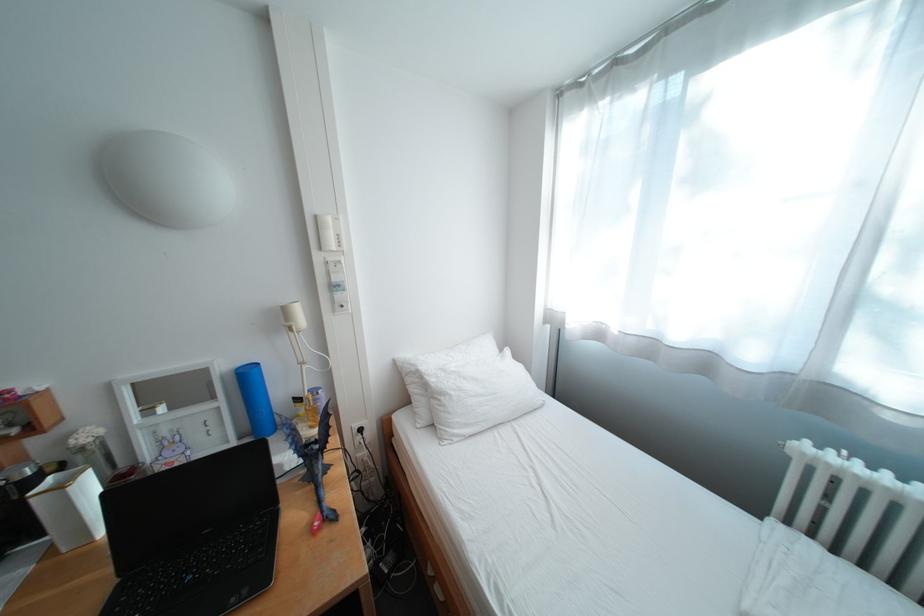
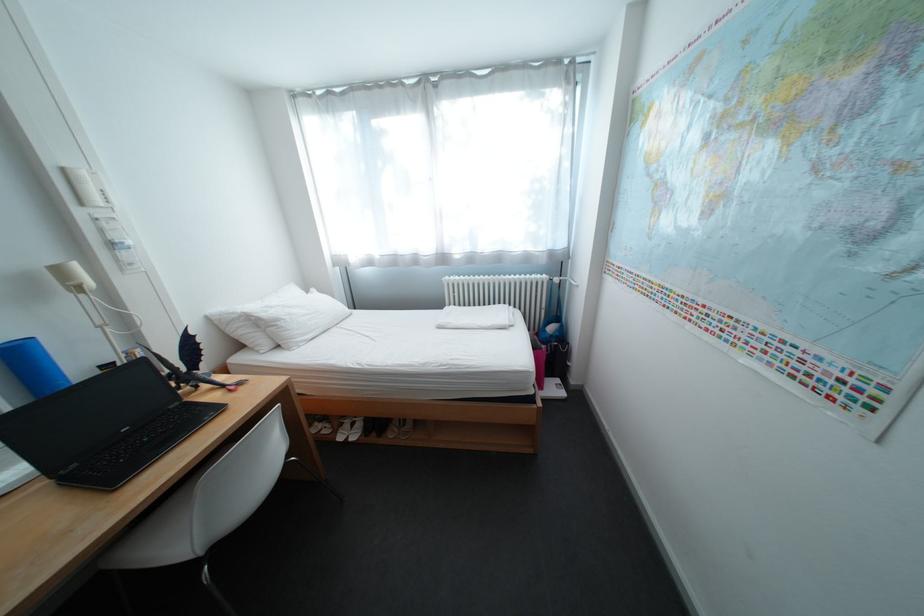
The point at (297, 312) is marked in the first image. Where is the corresponding point in the second image?

(71, 272)